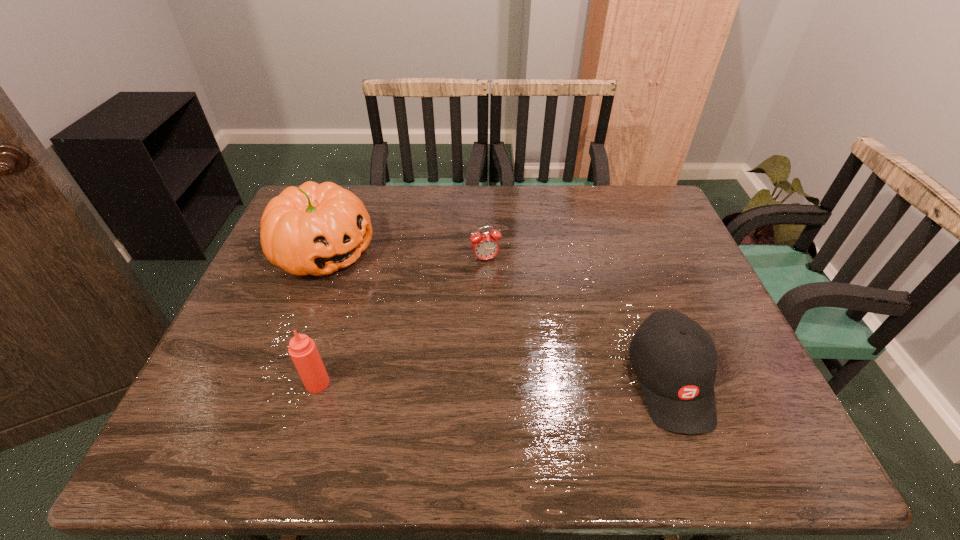
Locate an element on the screen. The height and width of the screenshot is (540, 960). vacant space located on the face of the alarm clock is located at coordinates (531, 381).

Identify the location of object located in the far edge section of the desktop. (315, 229).

Identify the location of Tabasco sauce present at the near edge. (302, 349).

Locate an element on the screen. Image resolution: width=960 pixels, height=540 pixels. baseball cap located at the near edge is located at coordinates (675, 360).

Identify the location of object located in the left edge section of the desktop. (315, 229).

Image resolution: width=960 pixels, height=540 pixels. I want to click on object that is at the right edge, so click(x=675, y=360).

This screenshot has width=960, height=540. Find the location of `object present at the far left corner`. object present at the far left corner is located at coordinates (315, 229).

Find the location of a particular element. This screenshot has width=960, height=540. object located in the near right corner section of the desktop is located at coordinates (675, 360).

The image size is (960, 540). What are the coordinates of `vacant space at the far edge` in the screenshot? It's located at (410, 204).

Where is `free space at the near edge of the desktop`? free space at the near edge of the desktop is located at coordinates (423, 380).